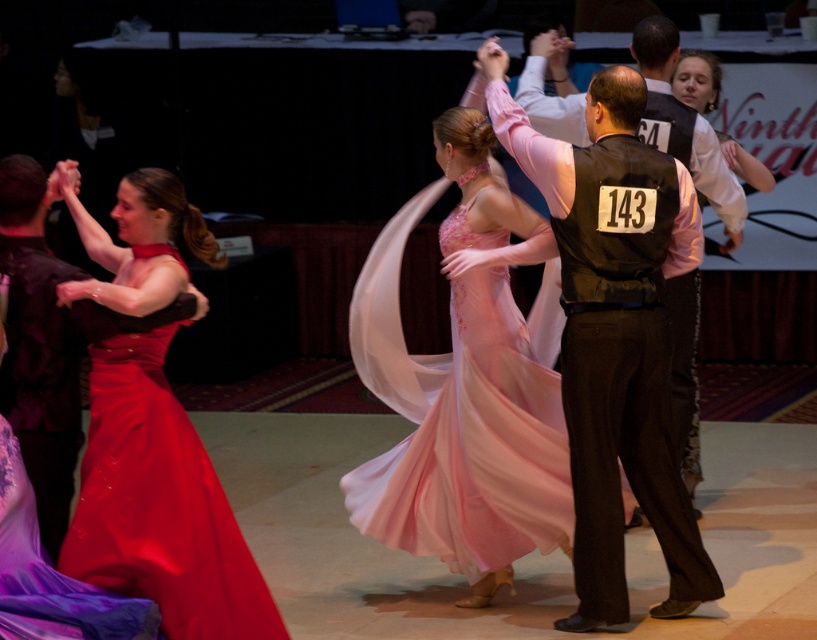
Does satin dress at left appear on the right side of black satin vest at center?

No, satin dress at left is not to the right of black satin vest at center.

The width and height of the screenshot is (817, 640). In order to click on satin dress at left in this screenshot , I will do `click(159, 504)`.

Can you confirm if matte black dress at left is wider than shiny satin dress at lower left?

Incorrect, matte black dress at left's width does not surpass shiny satin dress at lower left's.

I want to click on matte black dress at left, so click(39, 344).

Is point (179, 428) closer to viewer compared to point (57, 538)?

Yes.

Where is `satin dress at left`? satin dress at left is located at coordinates (159, 504).